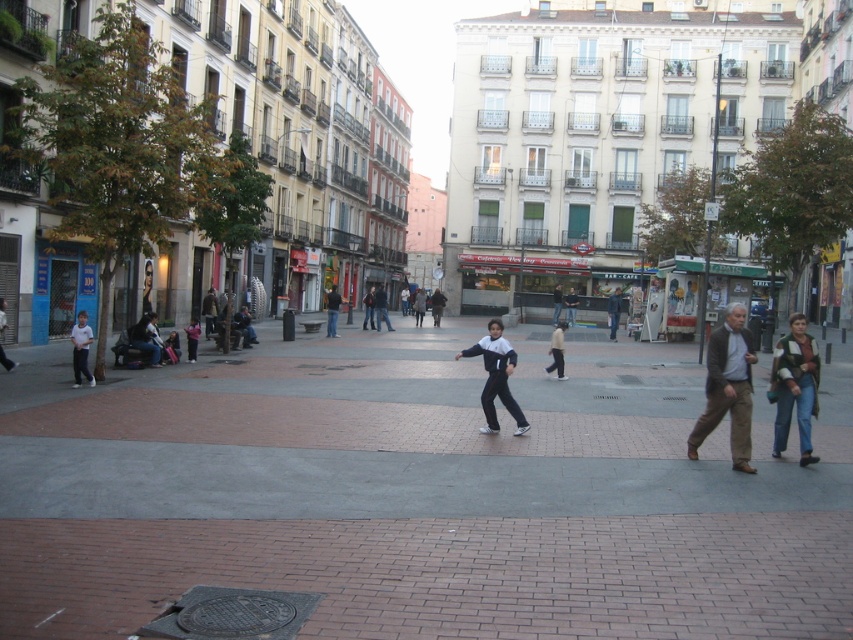
Does point (729, 412) come closer to viewer compared to point (563, 362)?

Yes, it is in front of point (563, 362).

At what (x,y) coordinates should I click in order to perform the action: click on brown leather jacket at right. Please return your answer as a coordinate pair (x, y). The height and width of the screenshot is (640, 853). Looking at the image, I should click on (728, 387).

Find the location of a particular element. This screenshot has width=853, height=640. brown leather jacket at right is located at coordinates (728, 387).

Is brown leather jacket at right bigger than dark blue jeans at center?

Actually, brown leather jacket at right might be smaller than dark blue jeans at center.

Does brown leather jacket at right lie behind dark blue jeans at center?

No, brown leather jacket at right is in front of dark blue jeans at center.

This screenshot has width=853, height=640. Find the location of `brown leather jacket at right`. brown leather jacket at right is located at coordinates (728, 387).

Is brown leather jacket at right smaller than white and black tracksuit at center?

No, brown leather jacket at right is not smaller than white and black tracksuit at center.

You are a GUI agent. You are given a task and a screenshot of the screen. Output one action in this format:
    pyautogui.click(x=<x>, y=<y>)
    Task: Click on the brown leather jacket at right
    
    Given the screenshot: What is the action you would take?
    pyautogui.click(x=728, y=387)